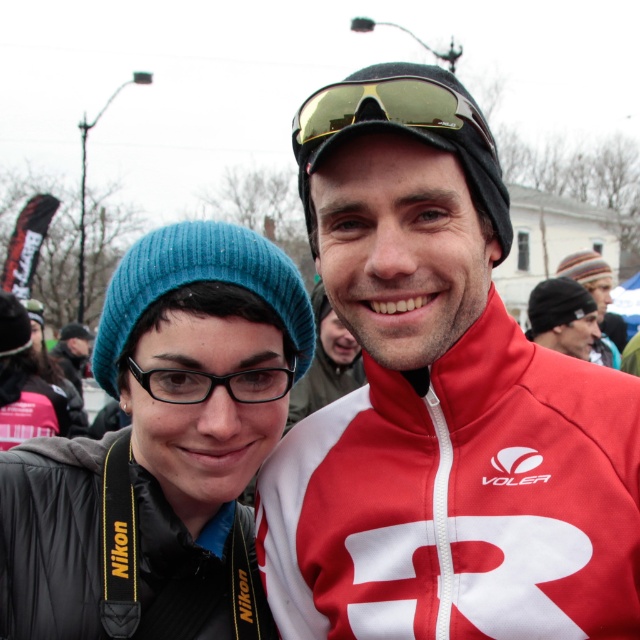
Question: Can you confirm if matte black beanie at left is wider than gold reflective goggles at center?

Choices:
 (A) no
 (B) yes

Answer: (B)

Question: From the image, what is the correct spatial relationship of matte black beanie at left in relation to black nylon jacket at lower left?

Choices:
 (A) right
 (B) left

Answer: (A)

Question: Which object is positioned closest to the gold reflective goggles at center?

Choices:
 (A) matte red jacket at center
 (B) black nylon jacket at lower left

Answer: (A)

Question: Does matte black beanie at left come in front of striped knit cap at upper right?

Choices:
 (A) no
 (B) yes

Answer: (B)

Question: Which point is closer to the camera taking this photo?

Choices:
 (A) (600, 284)
 (B) (172, 472)
 (C) (397, 116)
 (D) (504, 579)

Answer: (C)

Question: Which point appears farthest from the camera in this image?

Choices:
 (A) (545, 346)
 (B) (604, 280)
 (C) (321, 189)
 (D) (419, 90)

Answer: (B)